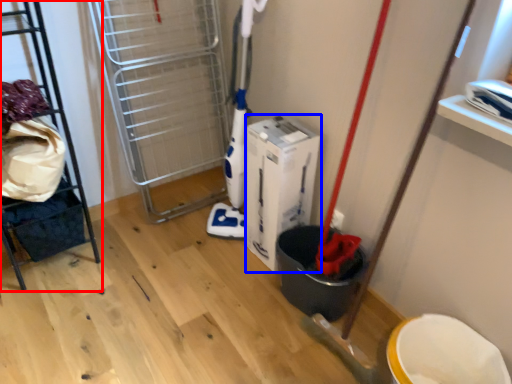
Question: Among these objects, which one is nearest to the camera, furniture (highlighted by a red box) or wide (highlighted by a blue box)?

Choices:
 (A) furniture
 (B) wide

Answer: (A)